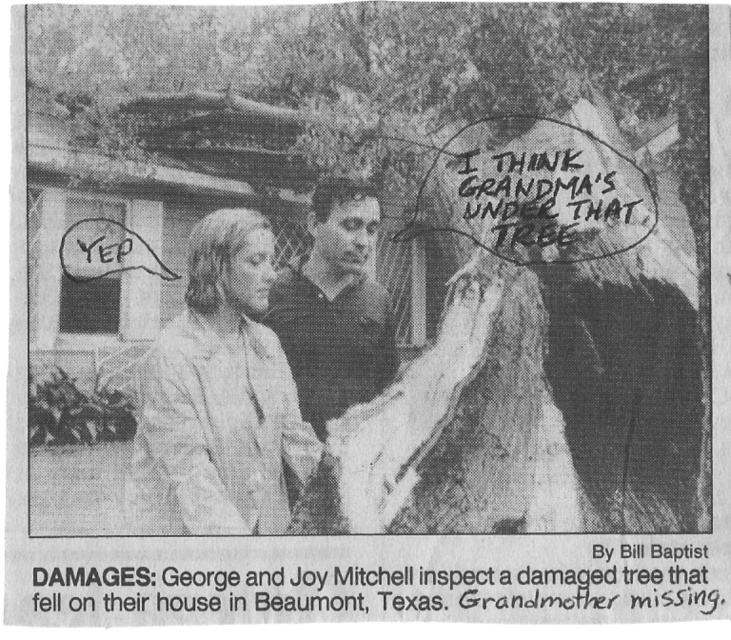
You are a photographer analyzing this black and white photo. The scene shows a damaged wood tree at center and a light beige fabric jacket at left. Which object is shorter in the photo?

The damaged wood tree at center is shorter than the light beige fabric jacket at left.

Based on the scene described, which object is larger in size between the damaged wood tree at center and the light beige fabric jacket at left?

The damaged wood tree at center is bigger than the light beige fabric jacket at left.